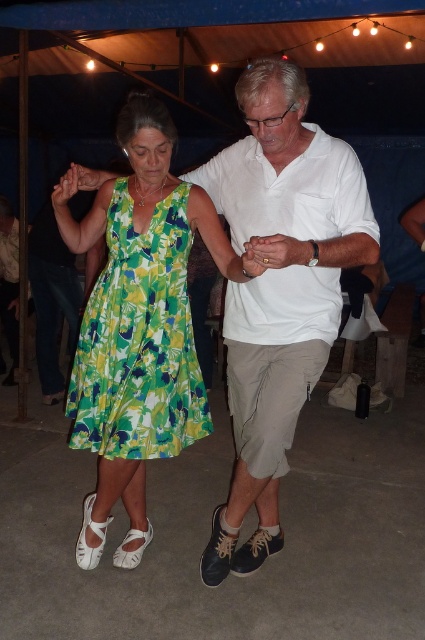
Question: Is green floral dress at left above green floral fabric dress at left?

Choices:
 (A) no
 (B) yes

Answer: (A)

Question: Which point appears farthest from the camera in this image?

Choices:
 (A) (155, 344)
 (B) (323, 134)
 (C) (118, 300)

Answer: (C)

Question: Which point is farther from the camera taking this photo?

Choices:
 (A) (240, 362)
 (B) (127, 376)
 (C) (121, 128)

Answer: (A)

Question: Considering the relative positions of white cotton shirt at center and green floral dress at left in the image provided, where is white cotton shirt at center located with respect to green floral dress at left?

Choices:
 (A) below
 (B) above

Answer: (B)

Question: Estimate the real-world distances between objects in this image. Which object is farther from the green floral fabric dress at left?

Choices:
 (A) green floral dress at left
 (B) white cotton shirt at center

Answer: (B)

Question: In this image, where is white cotton shirt at center located relative to green floral dress at left?

Choices:
 (A) below
 (B) above

Answer: (B)